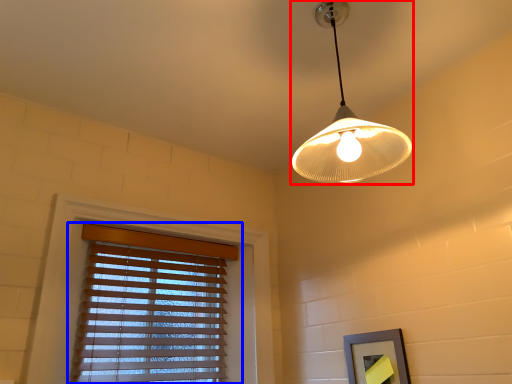
Question: Which point is further to the camera, lamp (highlighted by a red box) or window blind (highlighted by a blue box)?

Choices:
 (A) lamp
 (B) window blind

Answer: (B)